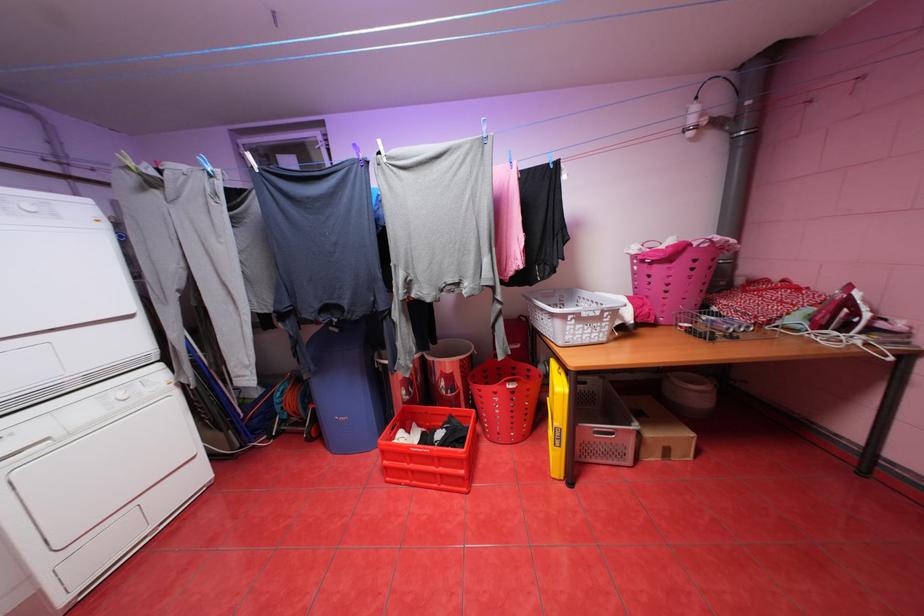
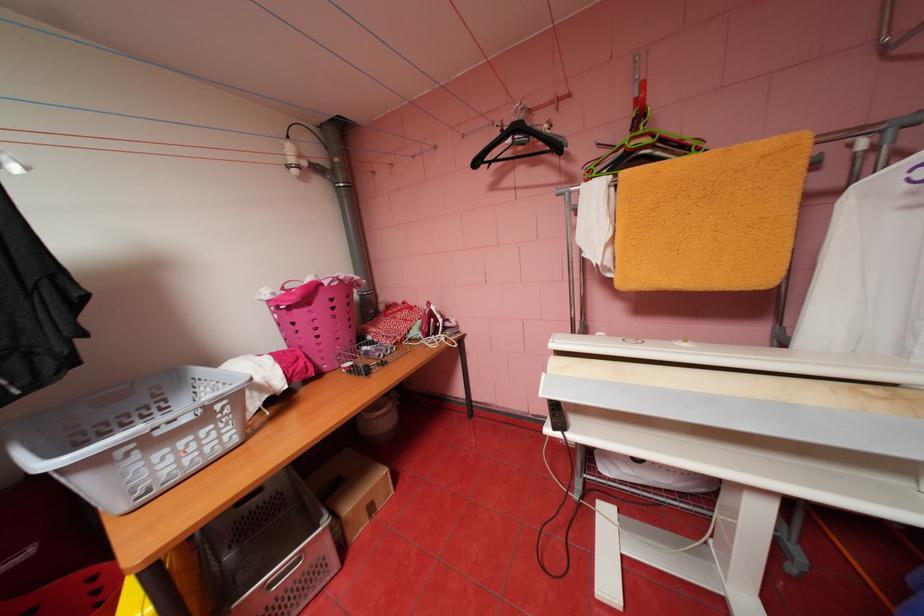
The point at (591, 333) is marked in the first image. Where is the corresponding point in the second image?

(187, 460)